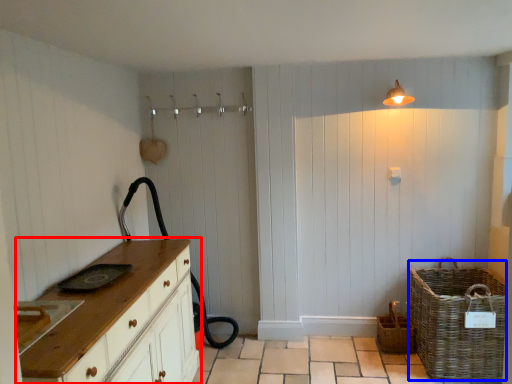
Question: Which object appears farthest to the camera in this image, chest of drawers (highlighted by a red box) or basket (highlighted by a blue box)?

Choices:
 (A) chest of drawers
 (B) basket

Answer: (B)